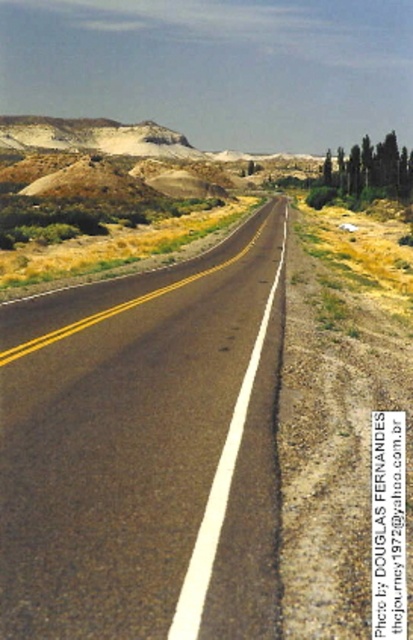
Who is more distant from viewer, (95, 317) or (377, 188)?

Positioned behind is point (377, 188).

Which is behind, point (208, 636) or point (351, 179)?

The point (351, 179) is behind.

Locate an element on the screen. The image size is (413, 640). black asphalt road at center is located at coordinates (146, 451).